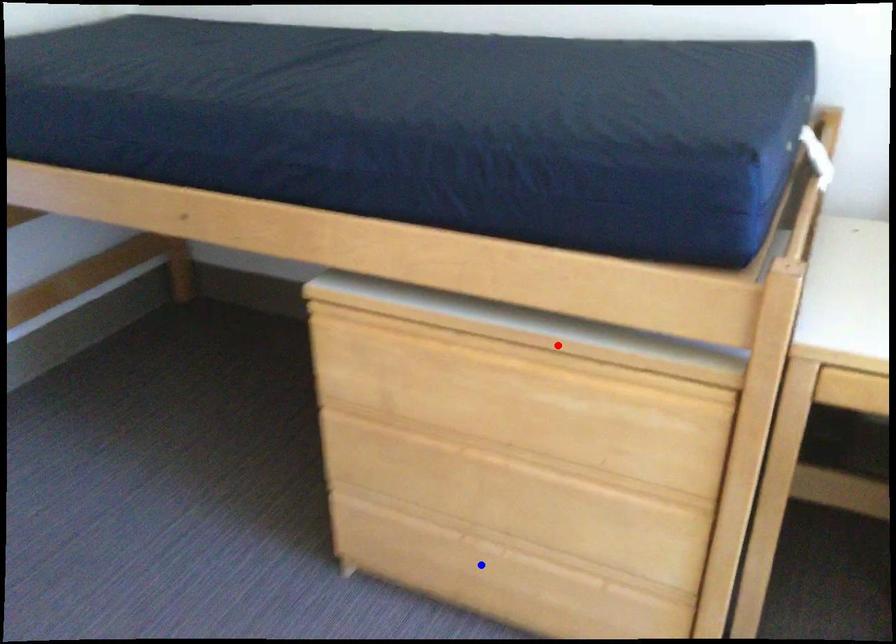
Question: In the image, two points are highlighted. Which point is nearer to the camera? Reply with the corresponding letter.

Choices:
 (A) blue point
 (B) red point

Answer: (B)